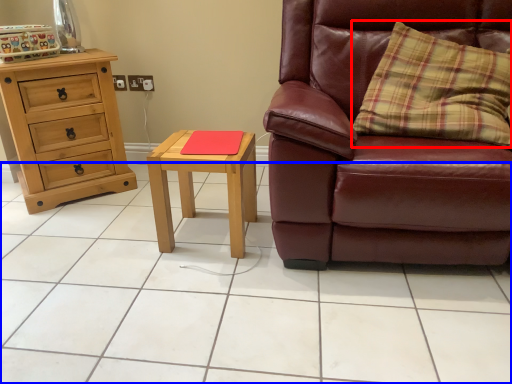
Question: Which object appears farthest to the camera in this image, pillow (highlighted by a red box) or ceramic tile (highlighted by a blue box)?

Choices:
 (A) pillow
 (B) ceramic tile

Answer: (A)